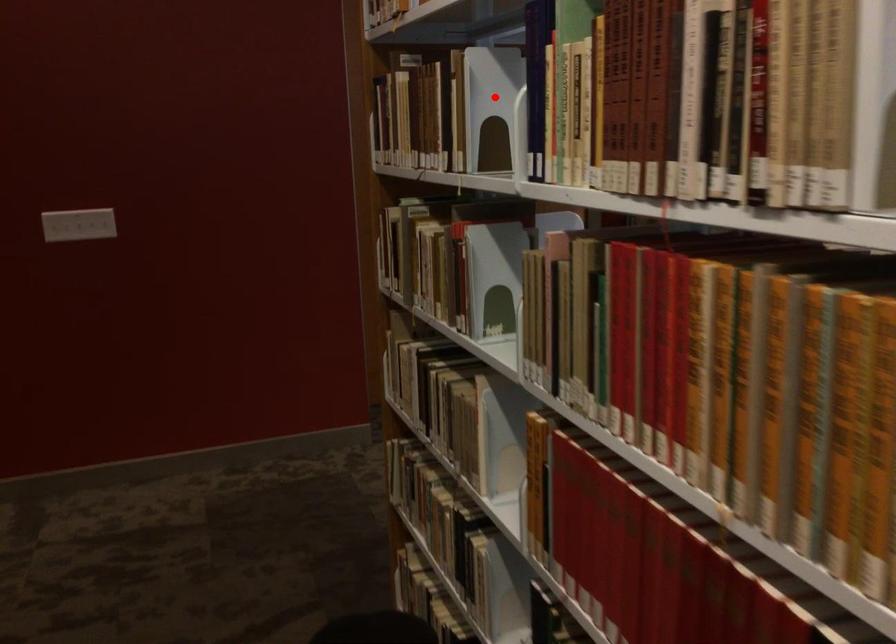
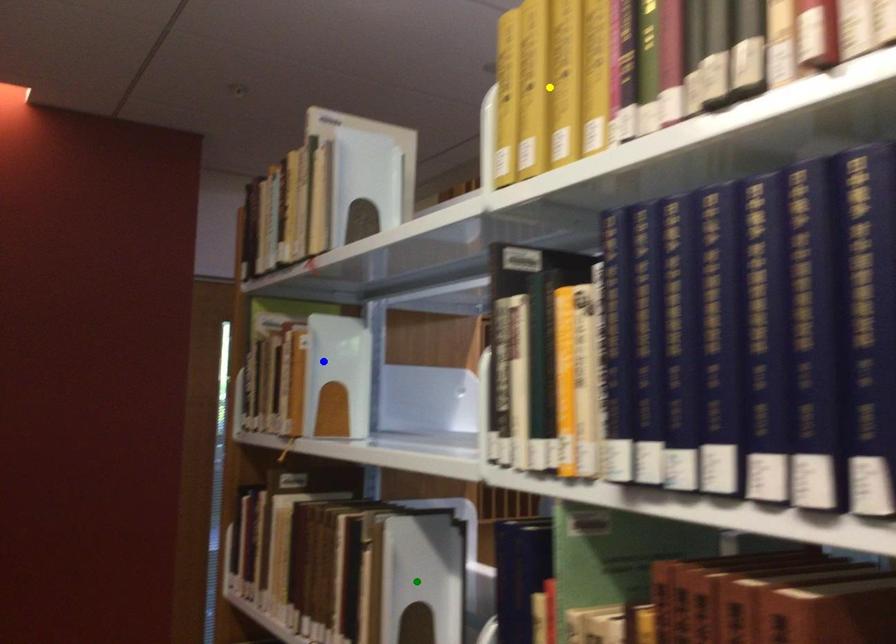
Question: I am providing you with two images of the same scene from different viewpoints. A red point is marked on the first image. You are given multiple points on the second image. Which point in image 2 is actually the same real-world point as the red point in image 1?

Choices:
 (A) yellow point
 (B) green point
 (C) blue point

Answer: (B)